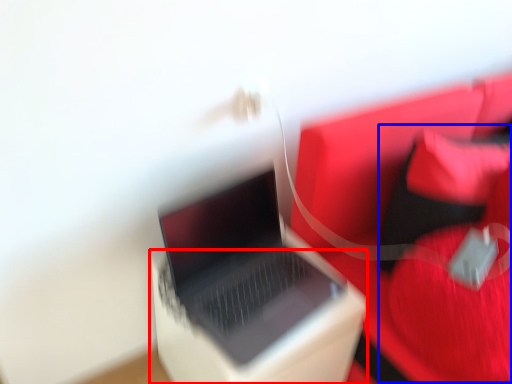
Question: Among these objects, which one is nearest to the camera, cardboard box (highlighted by a red box) or bean bag chair (highlighted by a blue box)?

Choices:
 (A) cardboard box
 (B) bean bag chair

Answer: (B)